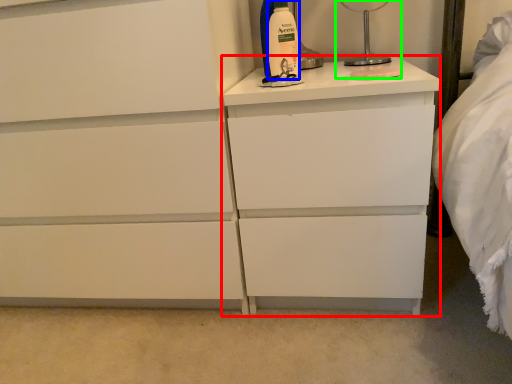
Question: Which object is the farthest from nightstand (highlighted by a red box)? Choose among these: cleaning product (highlighted by a blue box) or bedside lamp (highlighted by a green box).

Choices:
 (A) cleaning product
 (B) bedside lamp

Answer: (B)